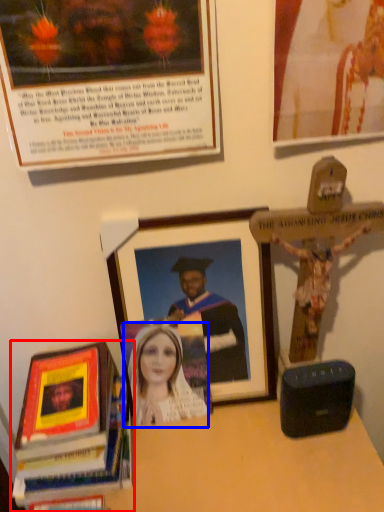
Question: Which point is further to the camera, book (highlighted by a red box) or woman (highlighted by a blue box)?

Choices:
 (A) book
 (B) woman

Answer: (B)